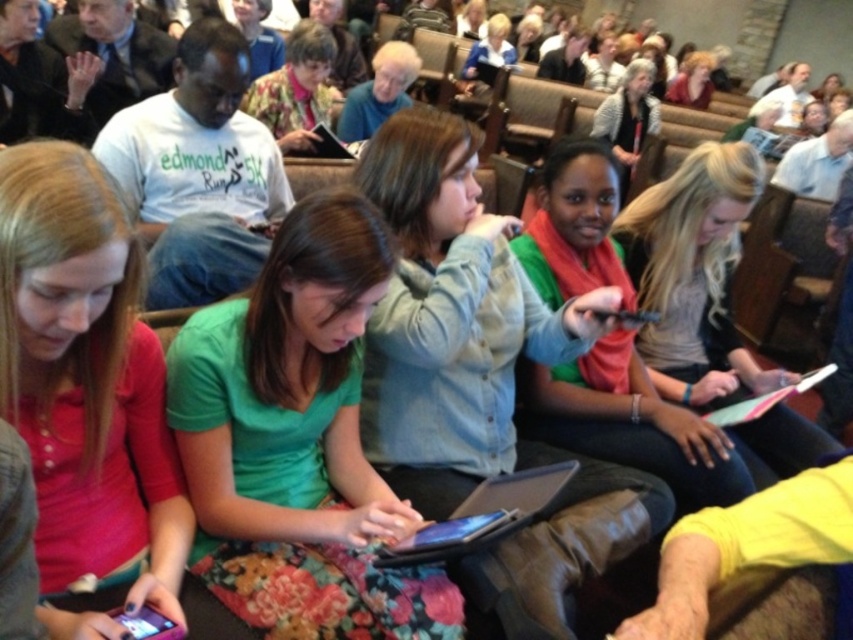
You are a photographer trying to capture a closeup of the light brown hair at center and the matte gray sweater at center. Based on their sizes, which one would require you to move closer to get a clear shot?

The light brown hair at center has a smaller size compared to the matte gray sweater at center, so you would need to move closer to capture the light brown hair at center in a clear closeup.

You are organizing a photo shoot and need to place a 18 inch wide prop between the green matte shirt at center and the matte black jacket at upper right. Based on their widths, will the prop fit between them?

The green matte shirt at center has a lesser width compared to matte black jacket at upper right, so the 18 inch wide prop may fit between them if the distance between the two objects is sufficient. However, the exact placement depends on the actual spacing between the two items in the image.

You are a photographer trying to capture a candid shot of the light brown hair at center and the matte gray sweater at center. Since you want to focus on the person with the shorter length, which object should you prioritize in your composition?

The light brown hair at center is shorter than the matte gray sweater at center, so you should prioritize the light brown hair at center in your composition.